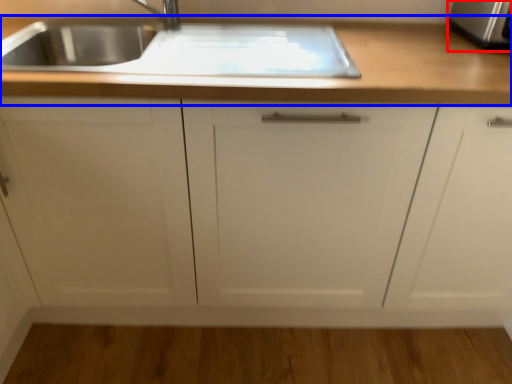
Question: Among these objects, which one is nearest to the camera, stainless steel (highlighted by a red box) or countertop (highlighted by a blue box)?

Choices:
 (A) stainless steel
 (B) countertop

Answer: (B)